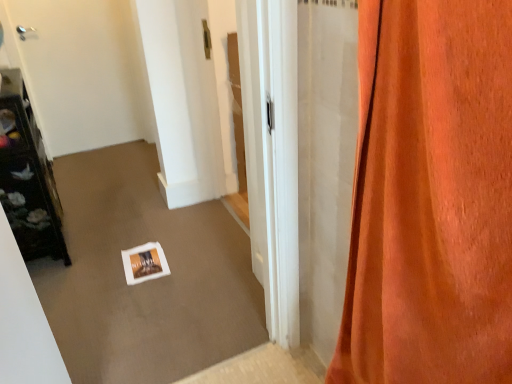
Find the location of a particular element. orange velvet curtain at right is located at coordinates (431, 197).

What do you see at coordinates (81, 71) in the screenshot? Image resolution: width=512 pixels, height=384 pixels. I see `white glossy door at upper left` at bounding box center [81, 71].

The image size is (512, 384). In order to click on white glossy door at upper left in this screenshot , I will do `click(81, 71)`.

I want to click on orange velvet curtain at right, so click(x=431, y=197).

From a real-world perspective, which is physically above, dark brown wooden shelf at left or white glossy door at upper left?

From a 3D spatial view, white glossy door at upper left is above.

Could you tell me if dark brown wooden shelf at left is facing white glossy door at upper left?

No, dark brown wooden shelf at left is not aimed at white glossy door at upper left.

Is dark brown wooden shelf at left bigger than white glossy door at upper left?

Yes.

Which is more to the left, dark brown wooden shelf at left or orange velvet curtain at right?

dark brown wooden shelf at left.

Is dark brown wooden shelf at left facing away from orange velvet curtain at right?

dark brown wooden shelf at left does not have its back to orange velvet curtain at right.

From the image's perspective, which object appears higher, dark brown wooden shelf at left or orange velvet curtain at right?

dark brown wooden shelf at left, from the image's perspective.

Considering the sizes of objects white glossy door at upper left and orange velvet curtain at right in the image provided, who is thinner, white glossy door at upper left or orange velvet curtain at right?

white glossy door at upper left.

What are the coordinates of `curtain below the white glossy door at upper left (from the image's perspective)` in the screenshot? It's located at (431, 197).

Is white glossy door at upper left directly adjacent to orange velvet curtain at right?

No, white glossy door at upper left is not in contact with orange velvet curtain at right.

Is white glossy door at upper left bigger than orange velvet curtain at right?

Incorrect, white glossy door at upper left is not larger than orange velvet curtain at right.

From a real-world perspective, who is located higher, white glossy door at upper left or dark brown wooden shelf at left?

white glossy door at upper left, from a real-world perspective.

Is white glossy door at upper left positioned with its back to dark brown wooden shelf at left?

That's not correct — white glossy door at upper left is not looking away from dark brown wooden shelf at left.

From the image's perspective, which is above, white glossy door at upper left or dark brown wooden shelf at left?

white glossy door at upper left, from the image's perspective.

Between white glossy door at upper left and dark brown wooden shelf at left, which one has smaller width?

Thinner between the two is white glossy door at upper left.

Is orange velvet curtain at right further to camera compared to white glossy door at upper left?

No, it is in front of white glossy door at upper left.

How distant is orange velvet curtain at right from white glossy door at upper left?

They are 9.56 feet apart.

Can you confirm if orange velvet curtain at right is bigger than white glossy door at upper left?

Correct, orange velvet curtain at right is larger in size than white glossy door at upper left.

Does point (500, 50) come closer to viewer compared to point (44, 44)?

Yes, point (500, 50) is closer to viewer.

Can you confirm if orange velvet curtain at right is wider than dark brown wooden shelf at left?

Incorrect, the width of orange velvet curtain at right does not surpass that of dark brown wooden shelf at left.

Do you think orange velvet curtain at right is within dark brown wooden shelf at left, or outside of it?

orange velvet curtain at right is not enclosed by dark brown wooden shelf at left.

Who is smaller, orange velvet curtain at right or dark brown wooden shelf at left?

Smaller between the two is orange velvet curtain at right.

At what (x,y) coordinates should I click in order to perform the action: click on door on the left of dark brown wooden shelf at left. Please return your answer as a coordinate pair (x, y). The image size is (512, 384). Looking at the image, I should click on (81, 71).

The width and height of the screenshot is (512, 384). Identify the location of curtain that is on the right side of dark brown wooden shelf at left. (431, 197).

Considering their positions, is dark brown wooden shelf at left positioned closer to white glossy door at upper left than orange velvet curtain at right?

The object closer to white glossy door at upper left is dark brown wooden shelf at left.

Estimate the real-world distances between objects in this image. Which object is closer to dark brown wooden shelf at left, white glossy door at upper left or orange velvet curtain at right?

white glossy door at upper left is closer to dark brown wooden shelf at left.

Looking at the image, which one is located further to orange velvet curtain at right, dark brown wooden shelf at left or white glossy door at upper left?

white glossy door at upper left is further to orange velvet curtain at right.

When comparing their distances from orange velvet curtain at right, does white glossy door at upper left or dark brown wooden shelf at left seem closer?

dark brown wooden shelf at left lies closer to orange velvet curtain at right than the other object.

Looking at the image, which one is located further to dark brown wooden shelf at left, orange velvet curtain at right or white glossy door at upper left?

orange velvet curtain at right is further to dark brown wooden shelf at left.

Consider the image. Considering their positions, is orange velvet curtain at right positioned closer to white glossy door at upper left than dark brown wooden shelf at left?

dark brown wooden shelf at left is closer to white glossy door at upper left.

Locate an element on the screen. The height and width of the screenshot is (384, 512). furniture between orange velvet curtain at right and white glossy door at upper left in the front-back direction is located at coordinates (27, 176).